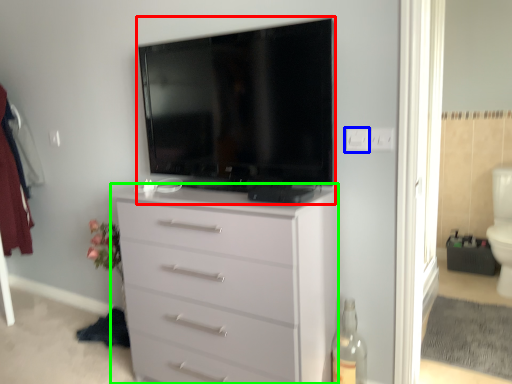
Question: Which object is the closest to the television (highlighted by a red box)? Choose among these: electric outlet (highlighted by a blue box) or chest of drawers (highlighted by a green box).

Choices:
 (A) electric outlet
 (B) chest of drawers

Answer: (B)